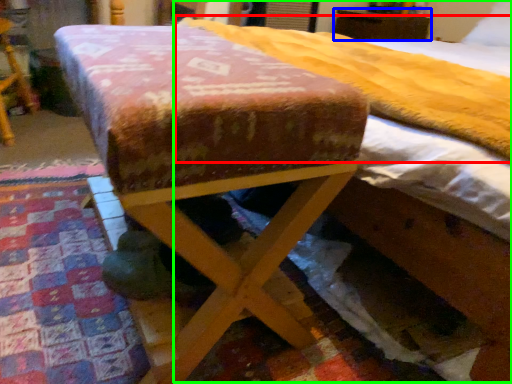
Question: Which is farther away from mattress (highlighted by a red box)? furniture (highlighted by a blue box) or bed (highlighted by a green box)?

Choices:
 (A) furniture
 (B) bed

Answer: (A)